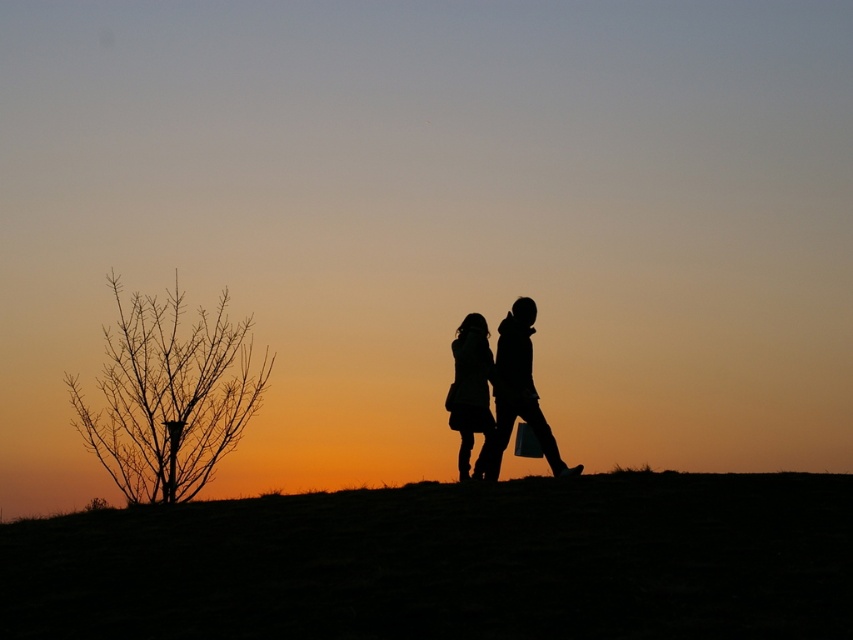
You are an artist trying to paint the sunset scene. You have to decide which area to focus on first based on size. Which object should you paint first, the dark grass at center or the silhouette clothing at center?

The dark grass at center is bigger than the silhouette clothing at center, so you should paint the dark grass at center first as it occupies a larger area in the scene.